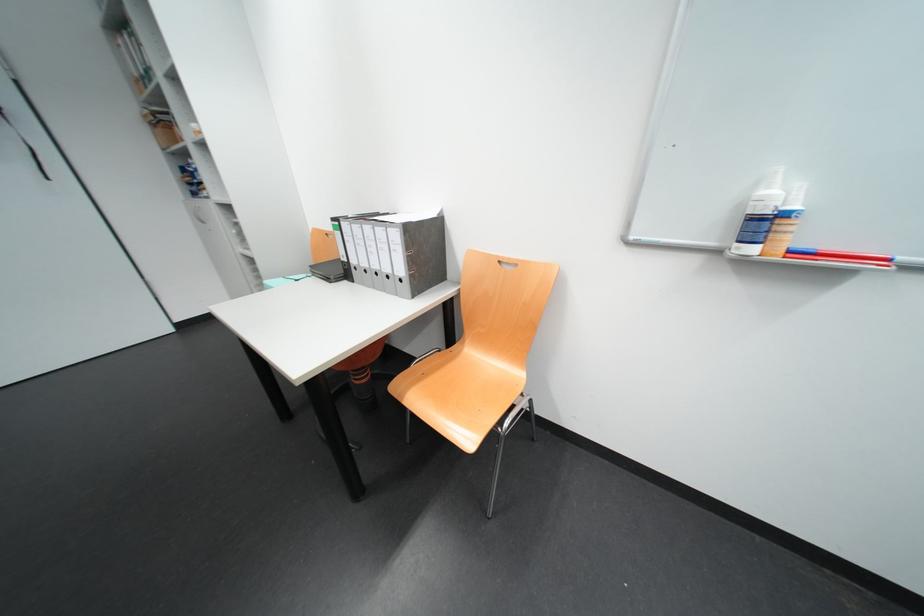
Which object does [759,216] point to?

It corresponds to the white spray bottle in the image.